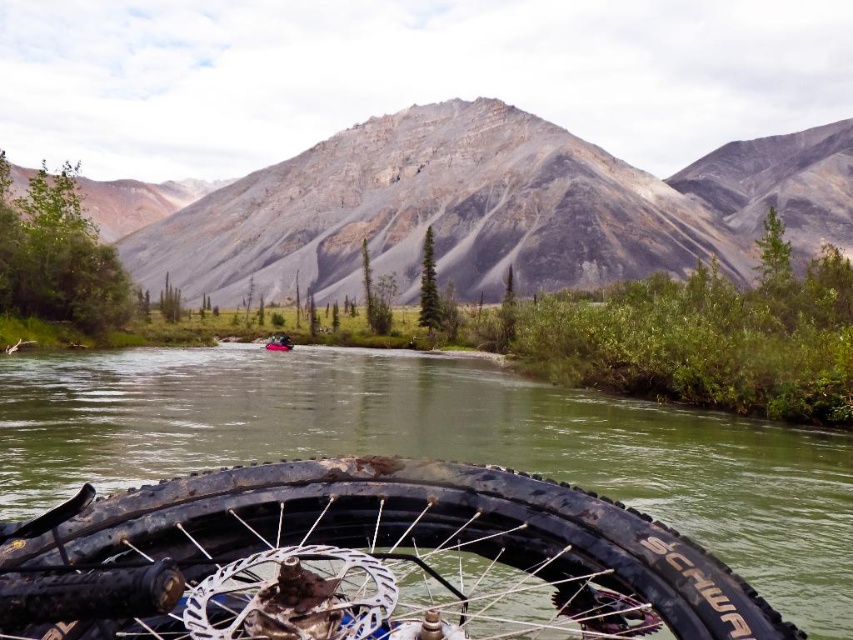
You are standing at the edge of the river and see the rusty metal tire at bottom and the rubber boat at center. Which object is closer to your feet?

The rusty metal tire at bottom is closer to your feet because it is located below the rubber boat at center.

You are planning to cross the river using the rubber boat at center. The rusty metal tire at bottom is blocking your path. Can you navigate around it without touching the tire?

The rusty metal tire at bottom is wider than the rubber boat at center. Since the tire is blocking the path, you can navigate around it as long as there is enough space on either side of the tire that is wider than the boat.